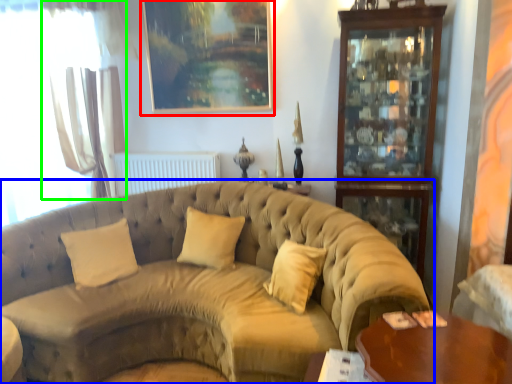
Question: Which object is the farthest from picture frame (highlighted by a red box)? Choose among these: studio couch (highlighted by a blue box) or curtain (highlighted by a green box).

Choices:
 (A) studio couch
 (B) curtain

Answer: (A)